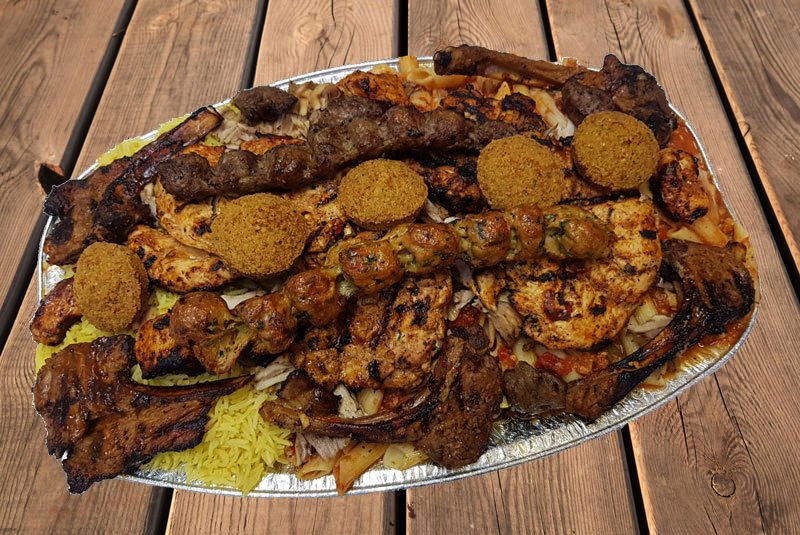
The image size is (800, 535). Find the location of `knots in wood`. knots in wood is located at coordinates click(8, 160), click(718, 481), click(788, 104), click(674, 24).